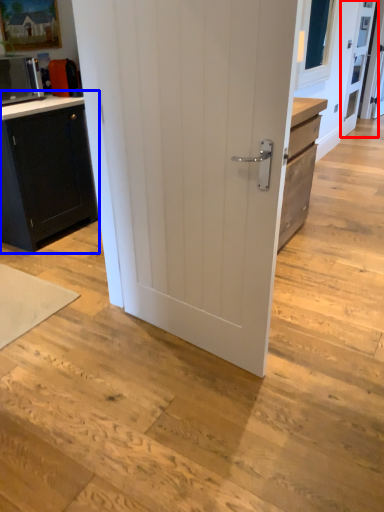
Question: Which point is further to the camera, screen door (highlighted by a red box) or cabinetry (highlighted by a blue box)?

Choices:
 (A) screen door
 (B) cabinetry

Answer: (A)